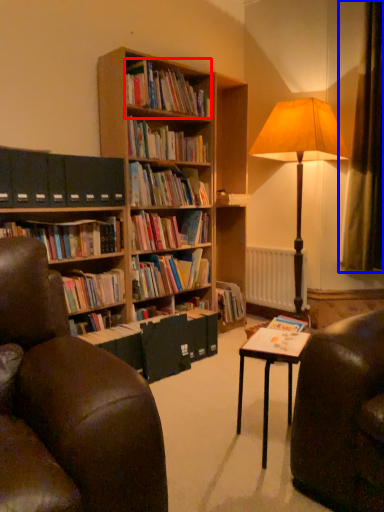
Question: Which object is closer to the camera taking this photo, book (highlighted by a red box) or curtain (highlighted by a blue box)?

Choices:
 (A) book
 (B) curtain

Answer: (A)